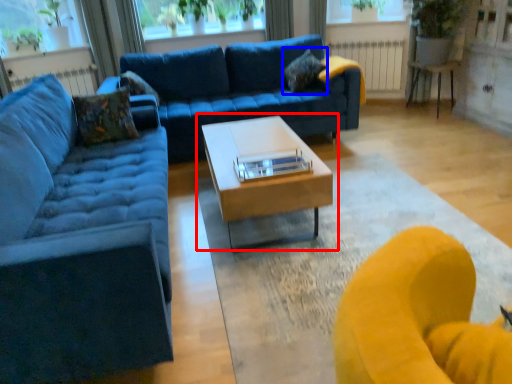
Question: Which object is closer to the camera taking this photo, coffee table (highlighted by a red box) or pillow (highlighted by a blue box)?

Choices:
 (A) coffee table
 (B) pillow

Answer: (A)